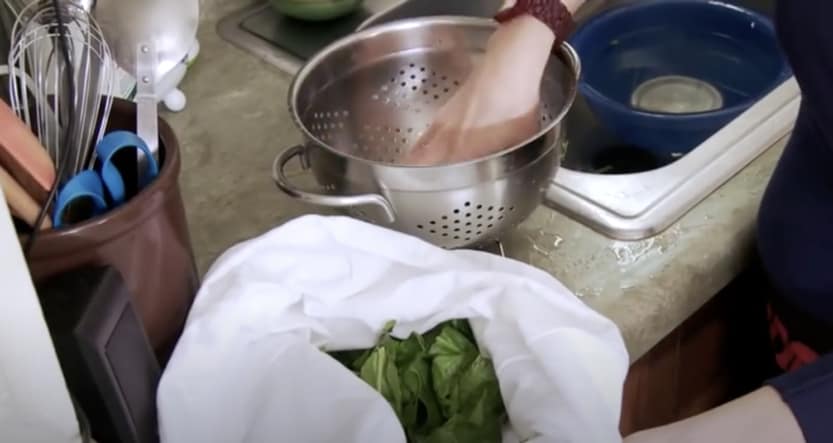
This screenshot has height=443, width=833. Identify the location of serving spoon. (143, 7).